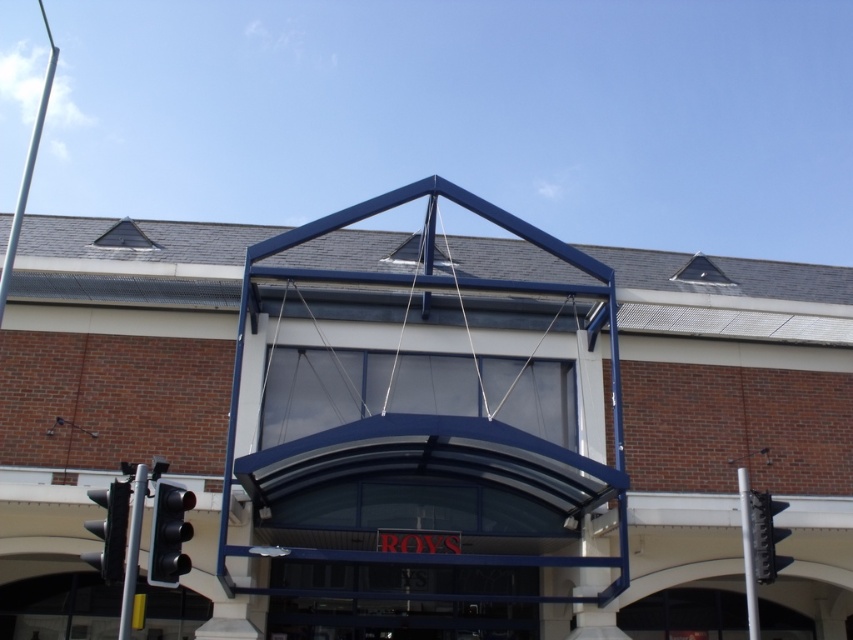
You are a pedestrian standing at the entrance of the building. You see two traffic lights, the black plastic traffic light at left and the black glass traffic light at right. Which one is positioned more to the left side?

The black plastic traffic light at left is positioned to the left of the black glass traffic light at right, so it is more on the left side.

You are standing at the entrance of the building and want to find the metallic traffic light pole at lower left. According to the coordinates provided, where exactly should you look to locate it?

The metallic traffic light pole at lower left is located at point coordinates (132, 550), so you should look towards the lower left area of the image at those specific coordinates to find it.